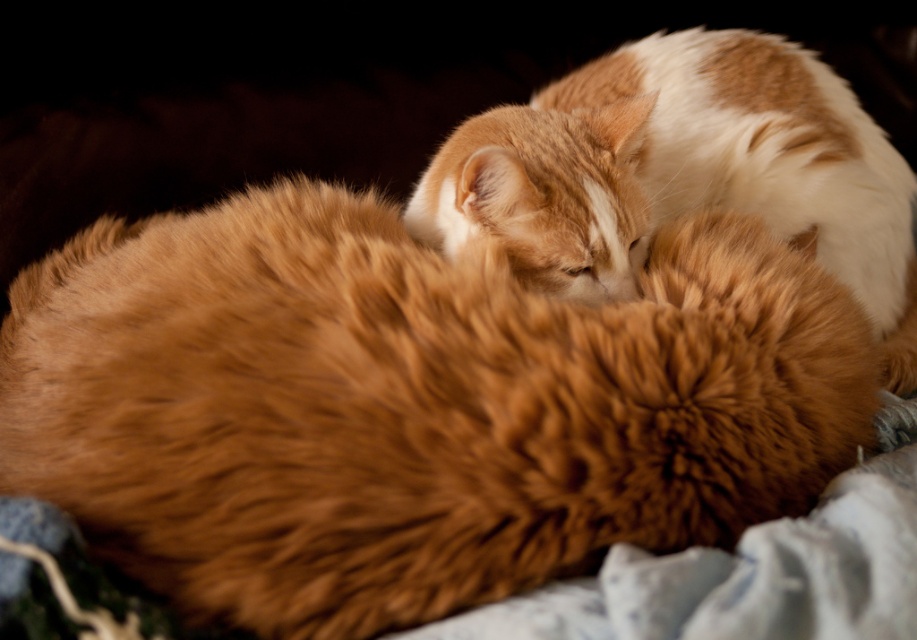
Who is higher up, fluffy orange cat at center or orange fur cat at upper right?

Positioned higher is orange fur cat at upper right.

Describe the element at coordinates (410, 406) in the screenshot. Image resolution: width=917 pixels, height=640 pixels. I see `fluffy orange cat at center` at that location.

Find the location of a particular element. fluffy orange cat at center is located at coordinates (410, 406).